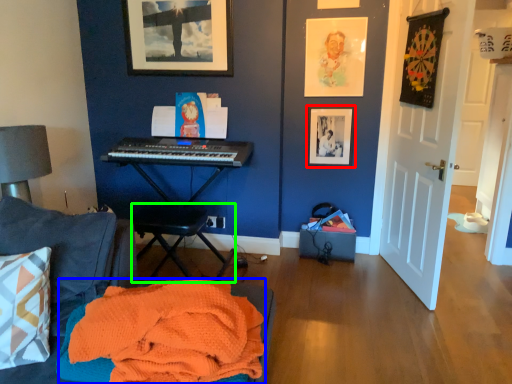
Question: Which is nearer to the picture frame (highlighted by a red box)? blanket (highlighted by a blue box) or music stool (highlighted by a green box).

Choices:
 (A) blanket
 (B) music stool

Answer: (B)